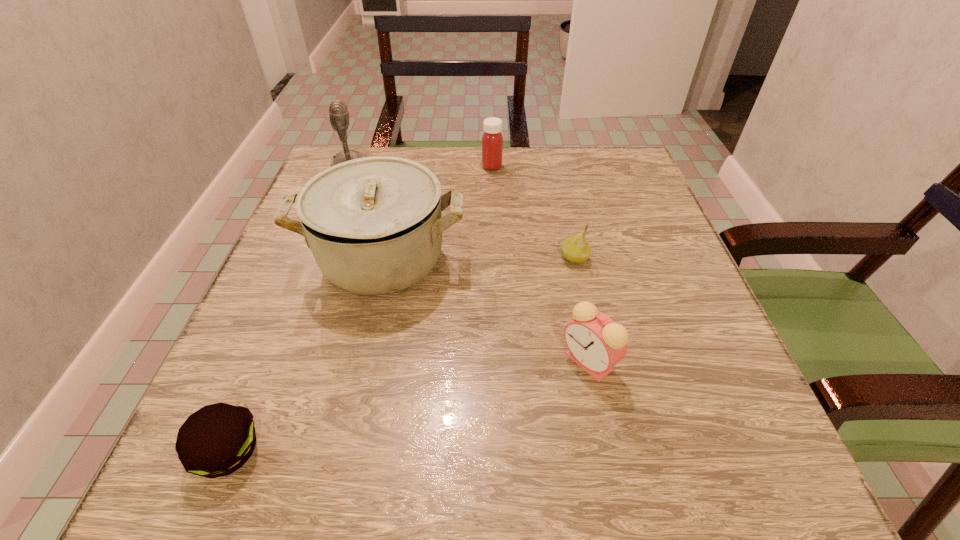
Image resolution: width=960 pixels, height=540 pixels. I want to click on microphone, so click(x=338, y=111).

At what (x,y) coordinates should I click in order to perform the action: click on saucepan. Please return your answer as a coordinate pair (x, y). This screenshot has width=960, height=540. Looking at the image, I should click on (374, 225).

The height and width of the screenshot is (540, 960). I want to click on the third object from right to left, so click(492, 141).

Where is `alarm clock`? The height and width of the screenshot is (540, 960). alarm clock is located at coordinates (596, 343).

Find the location of a particular element. The height and width of the screenshot is (540, 960). pear is located at coordinates (575, 249).

The width and height of the screenshot is (960, 540). Find the location of `the shortest object`. the shortest object is located at coordinates (218, 439).

At what (x,y) coordinates should I click in order to perform the action: click on patty. Please return your answer as a coordinate pair (x, y). This screenshot has height=540, width=960. Looking at the image, I should click on (218, 439).

Locate an element on the screen. vacant area located on the front-facing side of the microphone is located at coordinates (412, 167).

What are the coordinates of `free region located on the right of the saucepan` in the screenshot? It's located at (563, 259).

At what (x,y) coordinates should I click in order to perform the action: click on vacant space located 0.180m on the right of the third object from right to left. Please return your answer as a coordinate pair (x, y). The image size is (960, 540). Looking at the image, I should click on (574, 166).